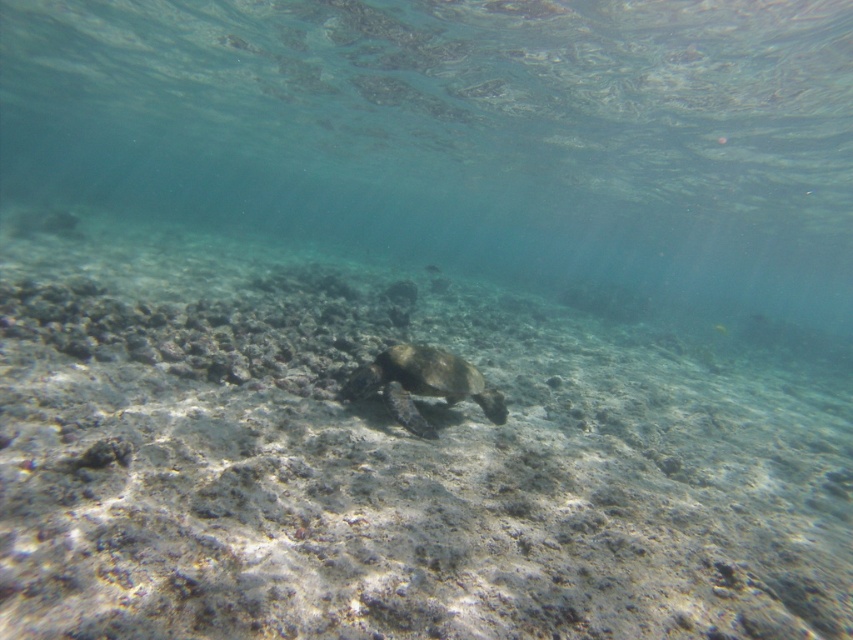
The width and height of the screenshot is (853, 640). What do you see at coordinates (389, 467) in the screenshot? I see `brown rocky coral reef at center` at bounding box center [389, 467].

Between brown rocky coral reef at center and greenish-brown textured shell at center, which one appears on the left side from the viewer's perspective?

brown rocky coral reef at center

The image size is (853, 640). What do you see at coordinates (389, 467) in the screenshot?
I see `brown rocky coral reef at center` at bounding box center [389, 467].

Locate an element on the screen. The height and width of the screenshot is (640, 853). brown rocky coral reef at center is located at coordinates (389, 467).